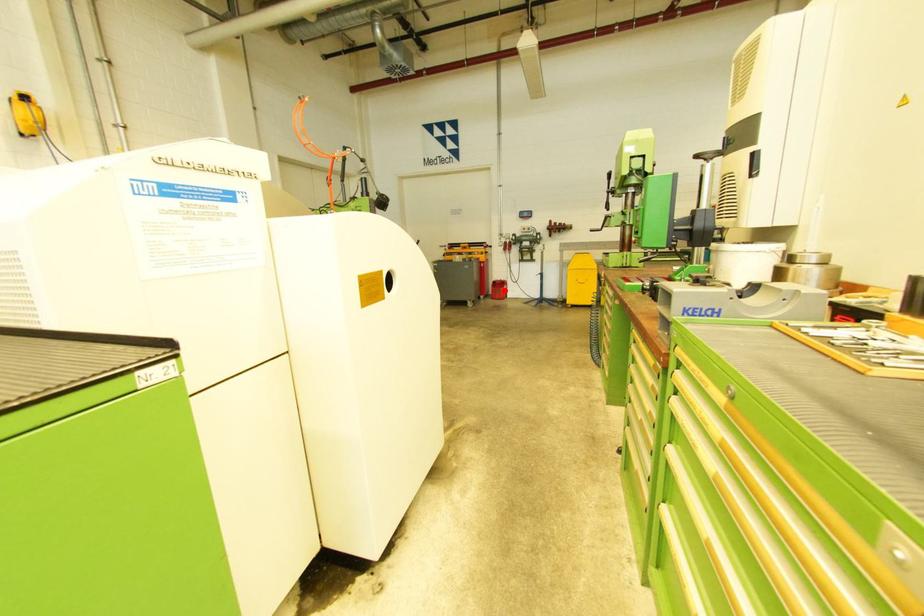
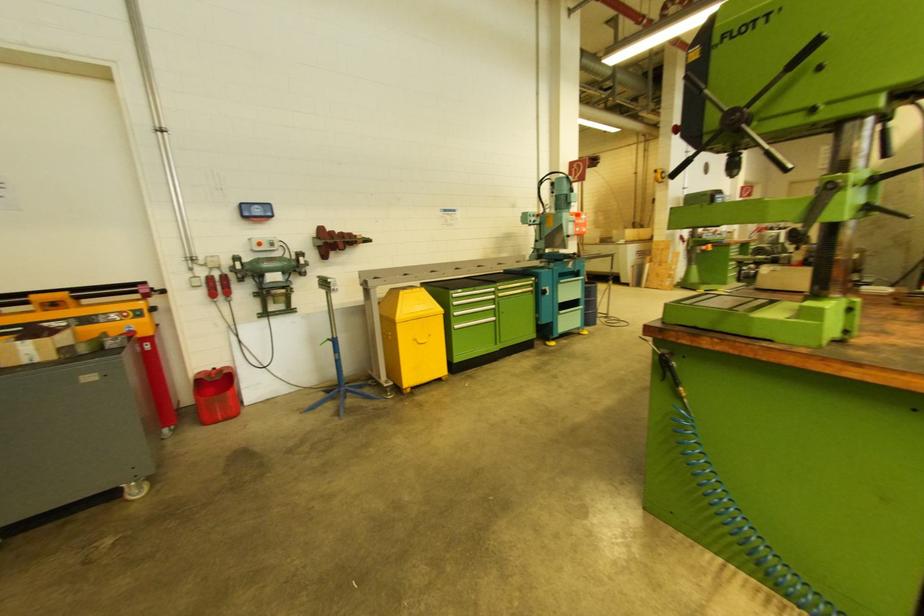
Question: I am providing you with two images of the same scene from different viewpoints. A red point is marked on the first image. Is the red point's position out of view in image 2?

Choices:
 (A) Yes
 (B) No

Answer: (B)